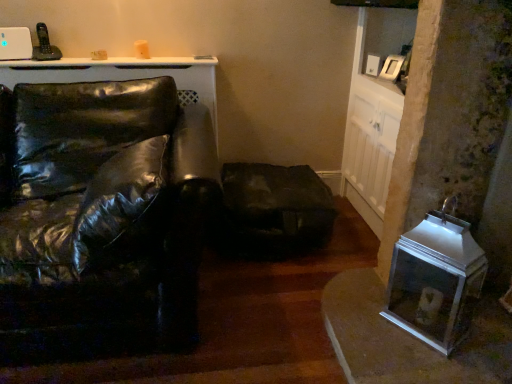
Question: Does dark brown leather swivel chair at center appear on the right side of glossy black leather couch at left?

Choices:
 (A) yes
 (B) no

Answer: (A)

Question: From a real-world perspective, is dark brown leather swivel chair at center below glossy black leather couch at left?

Choices:
 (A) no
 (B) yes

Answer: (B)

Question: Considering the relative sizes of dark brown leather swivel chair at center and glossy black leather couch at left in the image provided, is dark brown leather swivel chair at center wider than glossy black leather couch at left?

Choices:
 (A) no
 (B) yes

Answer: (A)

Question: Is dark brown leather swivel chair at center not inside glossy black leather couch at left?

Choices:
 (A) yes
 (B) no

Answer: (A)

Question: Considering the relative sizes of dark brown leather swivel chair at center and glossy black leather couch at left in the image provided, is dark brown leather swivel chair at center thinner than glossy black leather couch at left?

Choices:
 (A) yes
 (B) no

Answer: (A)

Question: Is dark brown leather swivel chair at center facing away from glossy black leather couch at left?

Choices:
 (A) no
 (B) yes

Answer: (A)

Question: Are metallic silver pet carrier at lower right and dark brown leather swivel chair at center beside each other?

Choices:
 (A) no
 (B) yes

Answer: (A)

Question: Is dark brown leather swivel chair at center at the back of metallic silver pet carrier at lower right?

Choices:
 (A) no
 (B) yes

Answer: (A)

Question: Is metallic silver pet carrier at lower right aimed at dark brown leather swivel chair at center?

Choices:
 (A) yes
 (B) no

Answer: (B)

Question: Is metallic silver pet carrier at lower right wider than dark brown leather swivel chair at center?

Choices:
 (A) yes
 (B) no

Answer: (B)

Question: Considering the relative sizes of metallic silver pet carrier at lower right and dark brown leather swivel chair at center in the image provided, is metallic silver pet carrier at lower right shorter than dark brown leather swivel chair at center?

Choices:
 (A) no
 (B) yes

Answer: (A)

Question: Considering the relative sizes of metallic silver pet carrier at lower right and dark brown leather swivel chair at center in the image provided, is metallic silver pet carrier at lower right thinner than dark brown leather swivel chair at center?

Choices:
 (A) yes
 (B) no

Answer: (A)

Question: Can you confirm if glossy black leather couch at left is taller than metallic silver pet carrier at lower right?

Choices:
 (A) yes
 (B) no

Answer: (A)